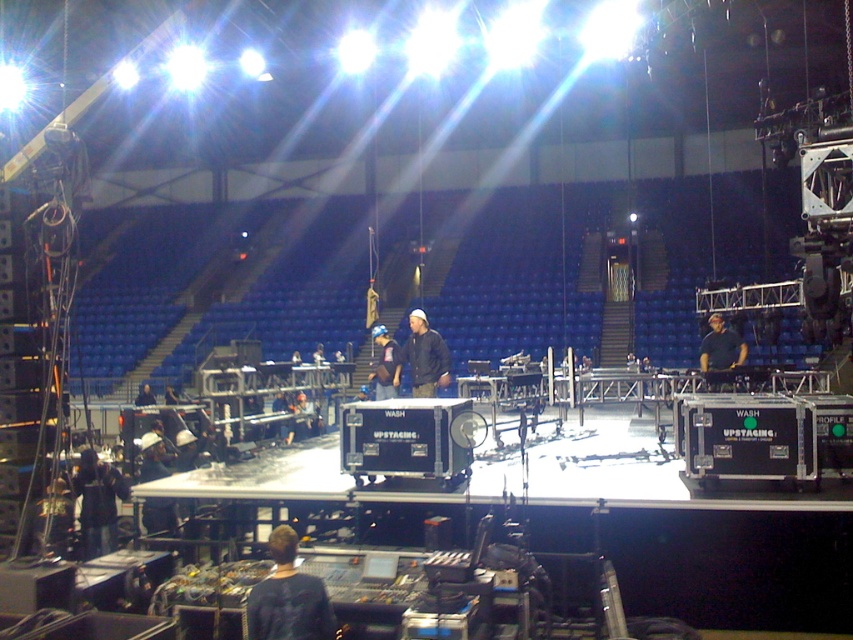
Question: Does dark blue jacket at center appear under dark blue shirt at center?

Choices:
 (A) no
 (B) yes

Answer: (B)

Question: Which object is closer to the camera taking this photo?

Choices:
 (A) dark blue shirt at center
 (B) dark blue jacket at center

Answer: (B)

Question: Is the position of dark blue jacket at center less distant than that of dark blue shirt at center?

Choices:
 (A) no
 (B) yes

Answer: (B)

Question: Is dark blue jacket at center smaller than dark blue shirt at center?

Choices:
 (A) no
 (B) yes

Answer: (B)

Question: Which of the following is the closest to the observer?

Choices:
 (A) dark blue shirt at center
 (B) dark blue jacket at center

Answer: (B)